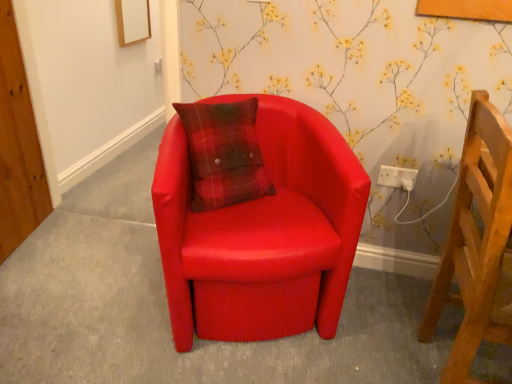
Question: Looking at their shapes, would you say white plastic socket at upper right is wider or thinner than matte red armchair at center?

Choices:
 (A) thin
 (B) wide

Answer: (A)

Question: In terms of size, does white plastic socket at upper right appear bigger or smaller than matte red armchair at center?

Choices:
 (A) big
 (B) small

Answer: (B)

Question: Which is nearer to the wooden chair at right, which appears as the 2th chair when viewed from the left?

Choices:
 (A) matte red armchair at center
 (B) matte leather chair at center, which appears as the second chair when viewed from the right
 (C) white plastic socket at upper right

Answer: (B)

Question: Which of these objects is positioned closest to the wooden chair at right, positioned as the first chair in right-to-left order?

Choices:
 (A) matte leather chair at center, which ranks as the 1th chair in left-to-right order
 (B) matte red armchair at center
 (C) white plastic socket at upper right

Answer: (A)